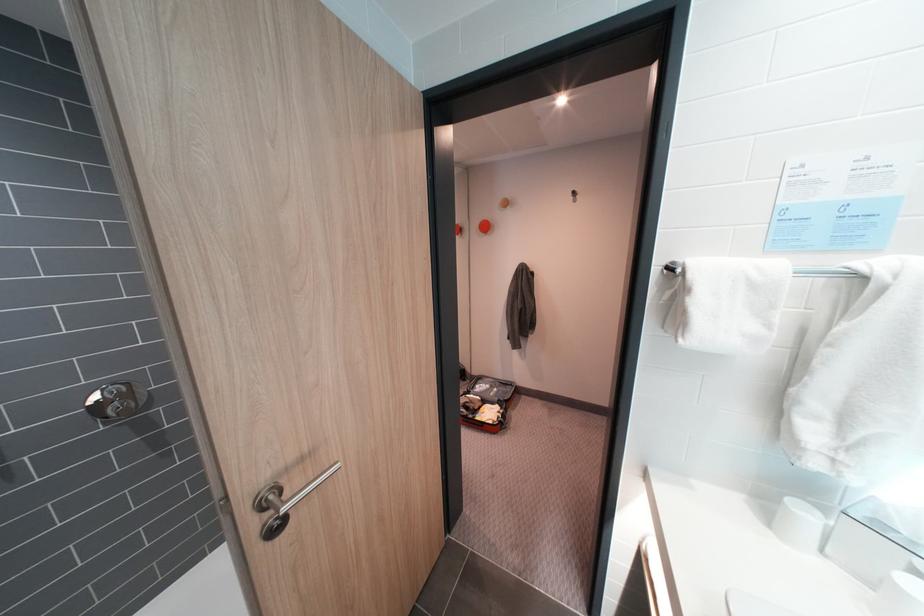
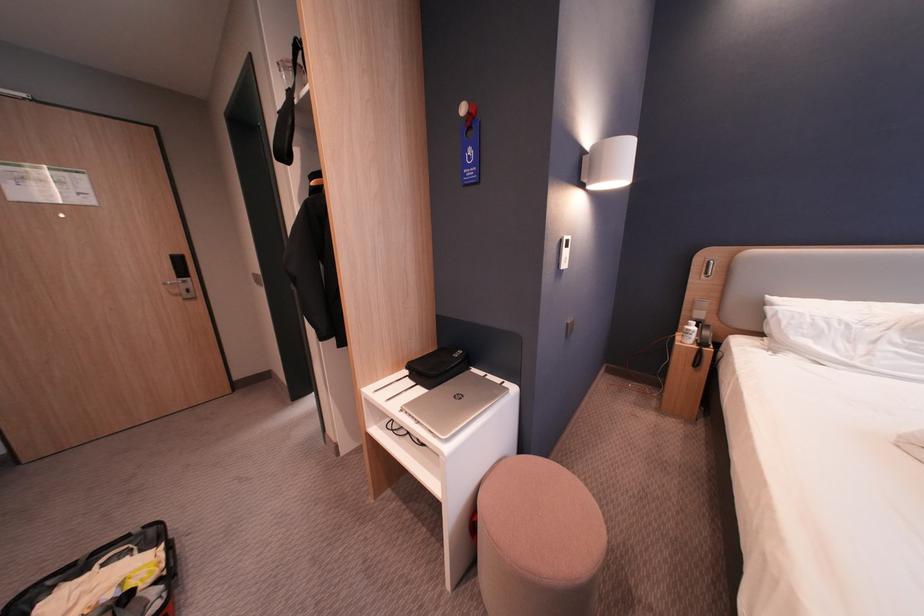
Question: I am providing you with two images of the same scene from different viewpoints. Which of the following objects are not visible in image2?

Choices:
 (A) coca-cola bottle
 (B) white wall switch
 (C) pink stool sitting surface
 (D) white paper cup

Answer: (D)